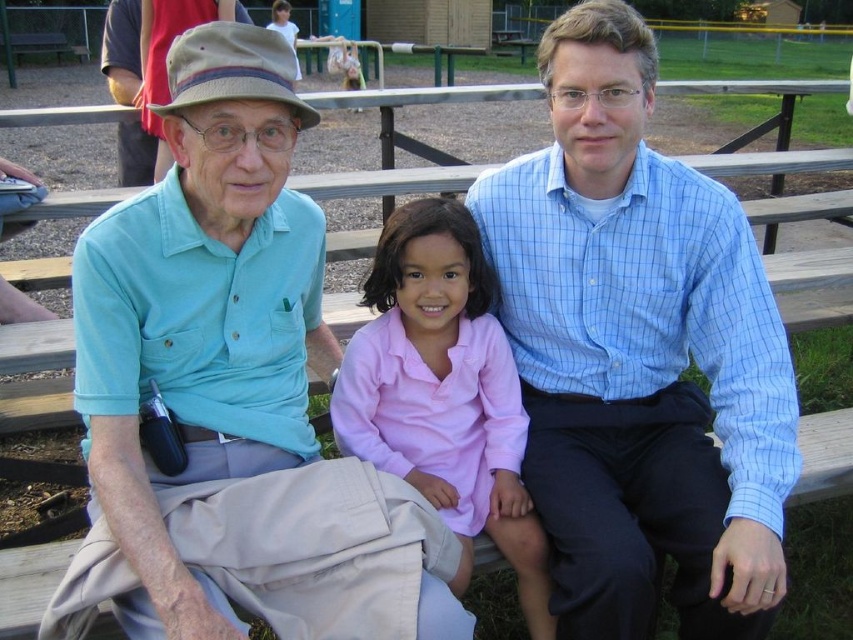
Who is higher up, light blue shirt at left or blue checkered shirt at center?

blue checkered shirt at center is above.

The image size is (853, 640). Identify the location of light blue shirt at left. (233, 384).

I want to click on light blue shirt at left, so click(x=233, y=384).

Is point (402, 588) in front of point (386, 420)?

Yes, point (402, 588) is in front of point (386, 420).

Who is positioned more to the right, light blue shirt at left or pink cotton shirt at center?

pink cotton shirt at center is more to the right.

The height and width of the screenshot is (640, 853). What do you see at coordinates (233, 384) in the screenshot? I see `light blue shirt at left` at bounding box center [233, 384].

Where is `light blue shirt at left`? light blue shirt at left is located at coordinates (233, 384).

Can you confirm if blue checkered shirt at center is thinner than pink cotton shirt at center?

No, blue checkered shirt at center is not thinner than pink cotton shirt at center.

Is the position of blue checkered shirt at center less distant than that of pink cotton shirt at center?

Yes, blue checkered shirt at center is in front of pink cotton shirt at center.

Does point (741, 316) come behind point (448, 458)?

No, (741, 316) is closer to viewer.

Image resolution: width=853 pixels, height=640 pixels. I want to click on blue checkered shirt at center, so click(639, 353).